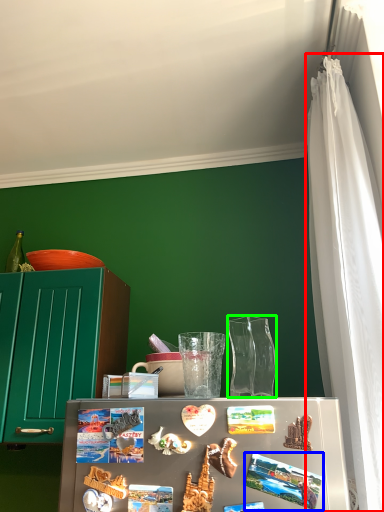
Question: Based on their relative distances, which object is farther from curtain (highlighted by a red box)? Choose from magnet (highlighted by a blue box) and glass vase (highlighted by a green box).

Choices:
 (A) magnet
 (B) glass vase

Answer: (A)